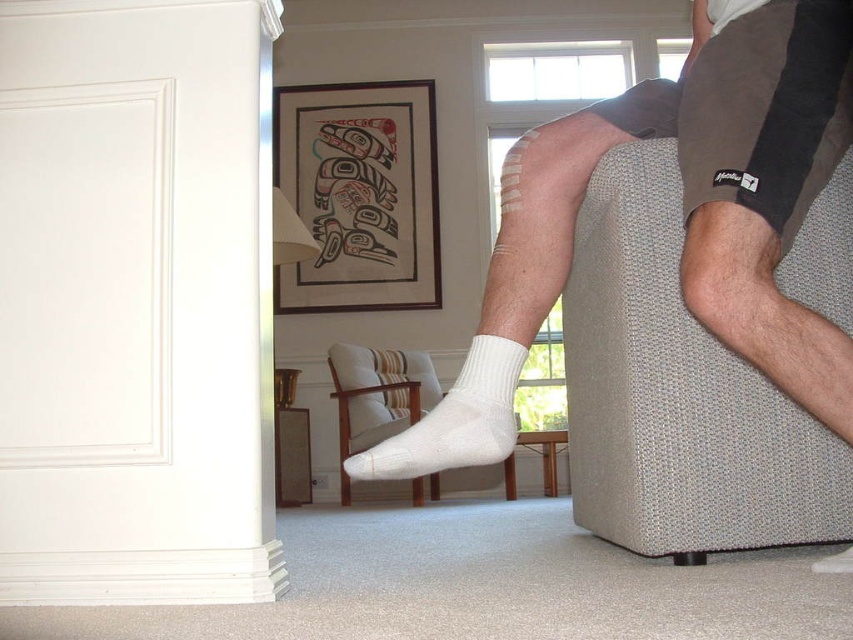
Is white painted wood at left bigger than white cotton socks at center?

No, white painted wood at left is not bigger than white cotton socks at center.

Can you confirm if white painted wood at left is smaller than white cotton socks at center?

Yes.

What do you see at coordinates (135, 301) in the screenshot? This screenshot has height=640, width=853. I see `white painted wood at left` at bounding box center [135, 301].

Identify the location of white painted wood at left. The height and width of the screenshot is (640, 853). (135, 301).

Which is behind, point (416, 428) or point (381, 352)?

Point (381, 352)

At what (x,y) coordinates should I click in order to perform the action: click on white cotton socks at center. Please return your answer as a coordinate pair (x, y). This screenshot has height=640, width=853. Looking at the image, I should click on (520, 282).

Locate an element on the screen. The image size is (853, 640). white cotton socks at center is located at coordinates (520, 282).

Who is positioned more to the right, textured beige armchair at right or white cotton sock at lower center?

Positioned to the right is textured beige armchair at right.

Can you confirm if textured beige armchair at right is positioned above white cotton sock at lower center?

Indeed, textured beige armchair at right is positioned over white cotton sock at lower center.

The width and height of the screenshot is (853, 640). Describe the element at coordinates (676, 394) in the screenshot. I see `textured beige armchair at right` at that location.

The height and width of the screenshot is (640, 853). In order to click on textured beige armchair at right in this screenshot , I will do `click(676, 394)`.